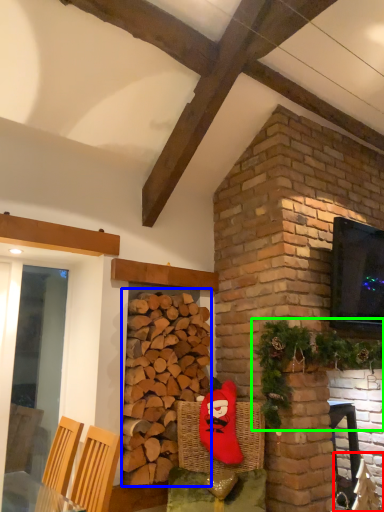
Question: Which object is the closest to the armchair (highlighted by a red box)? Choose among these: brickwork (highlighted by a blue box) or christmas decoration (highlighted by a green box).

Choices:
 (A) brickwork
 (B) christmas decoration

Answer: (B)